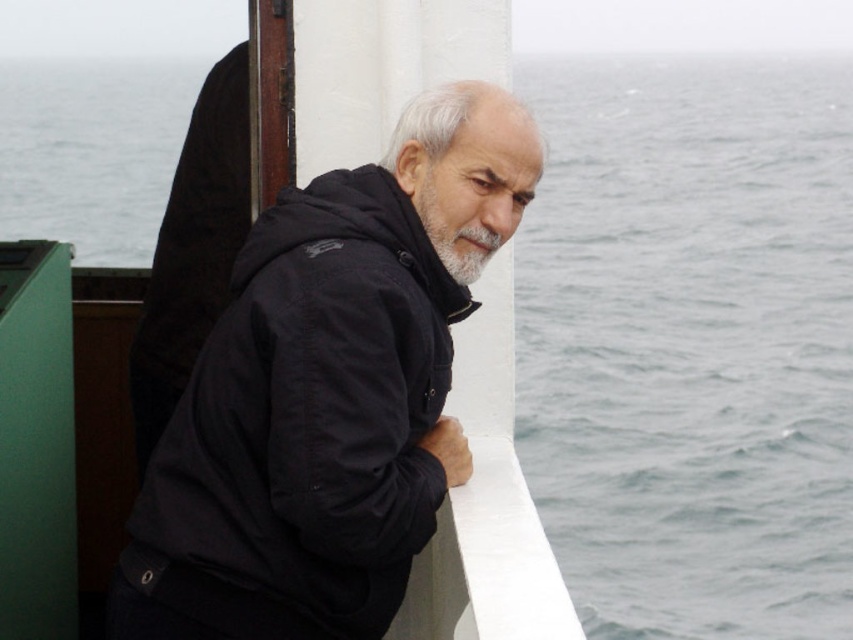
Question: Is black fabric jacket at center to the left of gray matte beard at center from the viewer's perspective?

Choices:
 (A) no
 (B) yes

Answer: (B)

Question: Can you confirm if gray water at upper right is wider than gray matte beard at center?

Choices:
 (A) yes
 (B) no

Answer: (A)

Question: Which of the following is the closest to the observer?

Choices:
 (A) (141, 492)
 (B) (473, 172)

Answer: (B)

Question: Can you confirm if black fabric jacket at center is positioned to the right of gray matte beard at center?

Choices:
 (A) yes
 (B) no

Answer: (B)

Question: Estimate the real-world distances between objects in this image. Which object is farther from the black fabric jacket at center?

Choices:
 (A) gray water at upper right
 (B) gray matte beard at center

Answer: (A)

Question: Among these points, which one is nearest to the camera?

Choices:
 (A) (467, 256)
 (B) (674, 179)

Answer: (A)